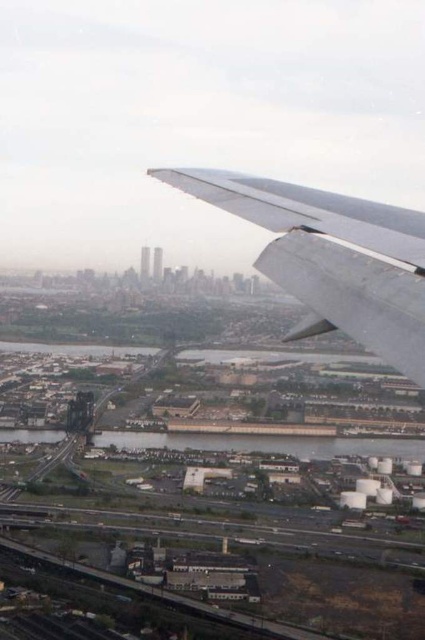
You are a passenger on the airplane looking out the window. You notice two points in the scene at coordinates point (258, 209) and point (110, 440). Which point is closer to the airplane window?

Point (110, 440) is closer to the airplane window because it is less further to the camera than point (258, 209).

You are a passenger on an airplane and notice the metallic gray wing at upper right and the metallic gray waterway at lower center through the window. Which object appears closer to you?

The metallic gray wing at upper right appears closer to you because it is further to the viewer than the metallic gray waterway at lower center.

You are a passenger on an airplane and notice two metallic wings visible through the window. Which wing, the metallic silver wing at upper right or the metallic gray wing at upper right, is positioned farther to the right side of the scene?

The metallic silver wing at upper right is positioned farther to the right side of the scene because it is to the right of the metallic gray wing at upper right.